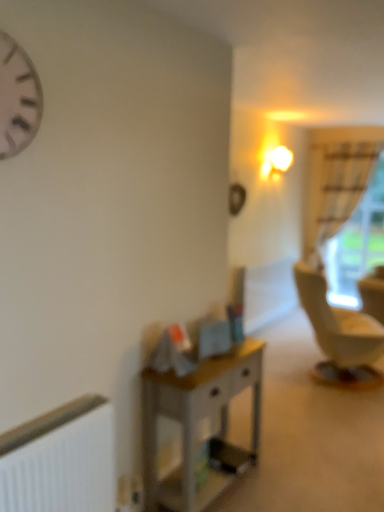
You are a GUI agent. You are given a task and a screenshot of the screen. Output one action in this format:
    pyautogui.click(x=<x>, y=<y>)
    Task: Click on the white matte clock at upper left
    
    Given the screenshot: What is the action you would take?
    pyautogui.click(x=17, y=98)

In order to click on white sheer curtain at right in this screenshot , I will do `click(339, 188)`.

In order to face wooden desk at center, should I rotate leftwards or rightwards?

You should look right and rotate roughly 2.216 degrees.

At what (x,y) coordinates should I click in order to perform the action: click on wooden desk at center. Please return your answer as a coordinate pair (x, y). This screenshot has width=384, height=512. Looking at the image, I should click on pos(198,421).

Identify the location of white matte radiator at lower left. Image resolution: width=384 pixels, height=512 pixels. (61, 460).

In the scene shown: Between wooden desk at center and white matte radiator at lower left, which one is positioned behind?

wooden desk at center is behind.

In the image, there is a white matte radiator at lower left. Identify the location of desk below it (from a real-world perspective). Image resolution: width=384 pixels, height=512 pixels. (198, 421).

Where is `radiator on the right of white matte clock at upper left`? The width and height of the screenshot is (384, 512). radiator on the right of white matte clock at upper left is located at coordinates (61, 460).

How much distance is there between white matte radiator at lower left and white matte clock at upper left?

white matte radiator at lower left is 1.12 meters away from white matte clock at upper left.

In the image, is white matte radiator at lower left positioned in front of or behind white matte clock at upper left?

white matte radiator at lower left is behind white matte clock at upper left.

Does white matte radiator at lower left touch white sheer curtain at right?

No, white matte radiator at lower left is not touching white sheer curtain at right.

From the image's perspective, between white matte radiator at lower left and white sheer curtain at right, who is located below?

white matte radiator at lower left appears lower in the image.

Considering the sizes of white matte radiator at lower left and white sheer curtain at right in the image, is white matte radiator at lower left taller or shorter than white sheer curtain at right?

white matte radiator at lower left is shorter than white sheer curtain at right.

Considering the positions of objects white matte radiator at lower left and white sheer curtain at right in the image provided, who is more to the right, white matte radiator at lower left or white sheer curtain at right?

Positioned to the right is white sheer curtain at right.

From a real-world perspective, is white matte clock at upper left positioned over white sheer curtain at right based on gravity?

Yes, from a real-world perspective, white matte clock at upper left is on top of white sheer curtain at right.

Which object is more forward, white matte clock at upper left or white sheer curtain at right?

Positioned in front is white matte clock at upper left.

Locate an element on the screen. Image resolution: width=384 pixels, height=512 pixels. clock that is above the white sheer curtain at right (from a real-world perspective) is located at coordinates (17, 98).

This screenshot has height=512, width=384. In order to click on radiator directly beneath the white matte clock at upper left (from a real-world perspective) in this screenshot , I will do `click(61, 460)`.

Between white matte clock at upper left and white matte radiator at lower left, which one has smaller size?

Smaller between the two is white matte clock at upper left.

Is white matte clock at upper left positioned in front of white matte radiator at lower left?

Yes, white matte clock at upper left is closer to the camera.

Consider the image. Is white matte clock at upper left inside the boundaries of white matte radiator at lower left, or outside?

white matte clock at upper left is spatially situated outside white matte radiator at lower left.

Which object is wider, white matte clock at upper left or wooden desk at center?

Wider between the two is wooden desk at center.

Is white matte clock at upper left inside or outside of wooden desk at center?

white matte clock at upper left is not enclosed by wooden desk at center.

Is white matte clock at upper left in front of or behind wooden desk at center in the image?

Visually, white matte clock at upper left is located in front of wooden desk at center.

In the image, is white matte clock at upper left on the left side or the right side of wooden desk at center?

white matte clock at upper left is positioned on wooden desk at center's left side.

There is a wooden desk at center. Where is `curtain above it (from a real-world perspective)`? This screenshot has width=384, height=512. curtain above it (from a real-world perspective) is located at coordinates (339, 188).

Is white sheer curtain at right positioned with its back to wooden desk at center?

white sheer curtain at right is not turned away from wooden desk at center.

From a real-world perspective, between white sheer curtain at right and wooden desk at center, who is vertically higher?

From a 3D spatial view, white sheer curtain at right is above.

Looking at this image, is white sheer curtain at right shorter than wooden desk at center?

No.

The image size is (384, 512). What are the coordinates of `radiator positioned vertically above the wooden desk at center (from a real-world perspective)` in the screenshot? It's located at (61, 460).

This screenshot has height=512, width=384. What are the coordinates of `clock above the white matte radiator at lower left (from the image's perspective)` in the screenshot? It's located at (17, 98).

Looking at the image, which one is located further to white matte clock at upper left, white matte radiator at lower left or white sheer curtain at right?

The object further to white matte clock at upper left is white sheer curtain at right.

Which object lies nearer to the anchor point white sheer curtain at right, white matte clock at upper left or white matte radiator at lower left?

white matte radiator at lower left is positioned closer to the anchor white sheer curtain at right.

Looking at the image, which one is located further to white sheer curtain at right, white matte radiator at lower left or wooden desk at center?

Based on the image, white matte radiator at lower left appears to be further to white sheer curtain at right.

When comparing their distances from white matte radiator at lower left, does white matte clock at upper left or white sheer curtain at right seem further?

white sheer curtain at right is positioned further to the anchor white matte radiator at lower left.

Estimate the real-world distances between objects in this image. Which object is further from wooden desk at center, white matte radiator at lower left or white sheer curtain at right?

white sheer curtain at right lies further to wooden desk at center than the other object.

From the image, which object appears to be farther from white matte radiator at lower left, white sheer curtain at right or white matte clock at upper left?

white sheer curtain at right is further to white matte radiator at lower left.

When comparing their distances from wooden desk at center, does white matte clock at upper left or white matte radiator at lower left seem further?

Based on the image, white matte clock at upper left appears to be further to wooden desk at center.

From the picture: Based on their spatial positions, is white sheer curtain at right or white matte radiator at lower left closer to white matte clock at upper left?

white matte radiator at lower left.

You are a GUI agent. You are given a task and a screenshot of the screen. Output one action in this format:
    pyautogui.click(x=<x>, y=<y>)
    Task: Click on the desk located between white matte radiator at lower left and white sheer curtain at right in the depth direction
    
    Given the screenshot: What is the action you would take?
    pyautogui.click(x=198, y=421)

Identify the location of desk between white matte clock at upper left and white matte radiator at lower left in the vertical direction. This screenshot has width=384, height=512. (198, 421).

Find the location of `radiator positioned between white matte clock at upper left and white sheer curtain at right from near to far`. radiator positioned between white matte clock at upper left and white sheer curtain at right from near to far is located at coordinates (61, 460).

The image size is (384, 512). Identify the location of desk located between white matte clock at upper left and white sheer curtain at right in the depth direction. 198,421.